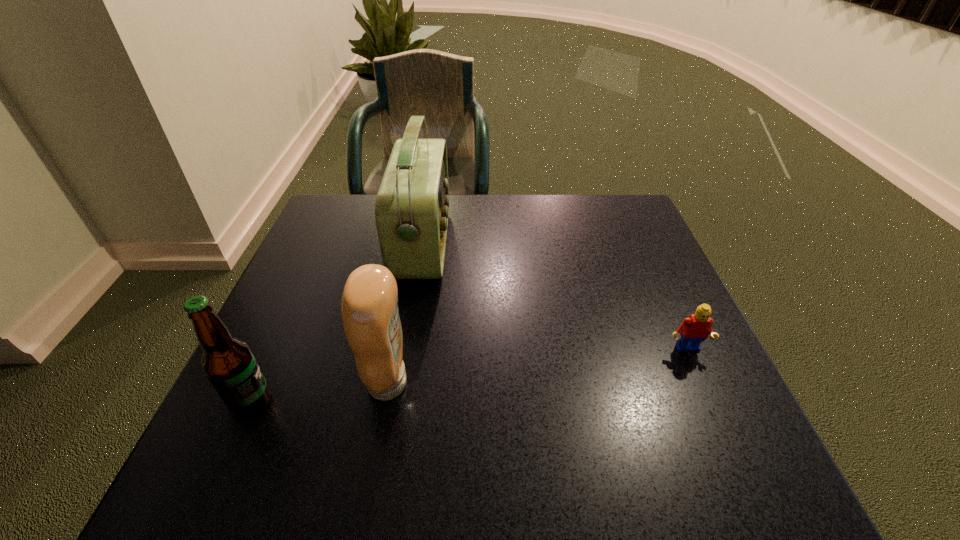
Find the location of `blank region between the rightmost object and the condiment`. blank region between the rightmost object and the condiment is located at coordinates (538, 367).

This screenshot has width=960, height=540. Identify the location of vacant area between the Lego and the beer bottle. (468, 376).

This screenshot has height=540, width=960. Identify the location of vacant space in between the radio receiver and the shortest object. (555, 297).

Find the location of a particular element. The image size is (960, 540). free spot between the farthest object and the shortest object is located at coordinates (555, 297).

Where is `empty location between the radio receiver and the beer bottle`? This screenshot has height=540, width=960. empty location between the radio receiver and the beer bottle is located at coordinates (337, 323).

You are a GUI agent. You are given a task and a screenshot of the screen. Output one action in this format:
    pyautogui.click(x=<x>, y=<y>)
    Task: Click on the vacant point located between the beer bottle and the condiment
    The image size is (960, 540).
    Given the screenshot: What is the action you would take?
    pyautogui.click(x=320, y=393)

Where is `vacant area that lies between the Lego and the farthest object`? This screenshot has width=960, height=540. vacant area that lies between the Lego and the farthest object is located at coordinates (x=555, y=297).

Locate an element on the screen. empty space that is in between the shortest object and the beer bottle is located at coordinates (468, 376).

Where is `free space between the farthest object and the beer bottle`? The image size is (960, 540). free space between the farthest object and the beer bottle is located at coordinates (337, 323).

I want to click on object that can be found as the second closest to the leftmost object, so click(x=412, y=204).